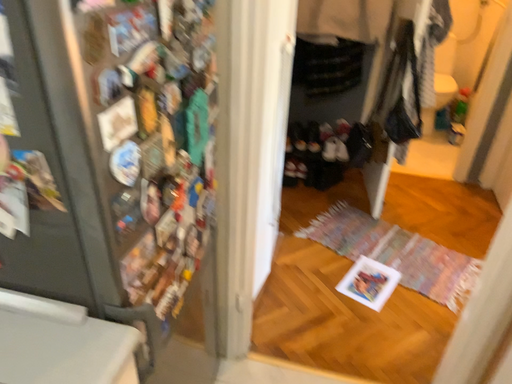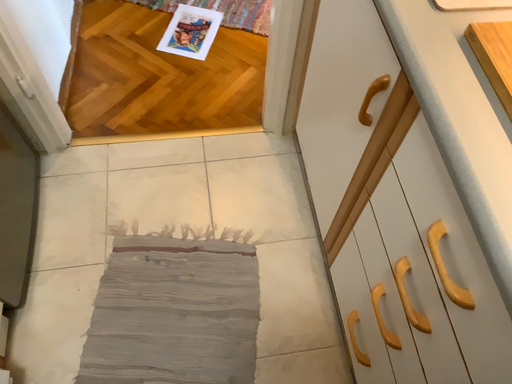
Question: Which way did the camera rotate in the video?

Choices:
 (A) rotated downward
 (B) rotated upward

Answer: (A)